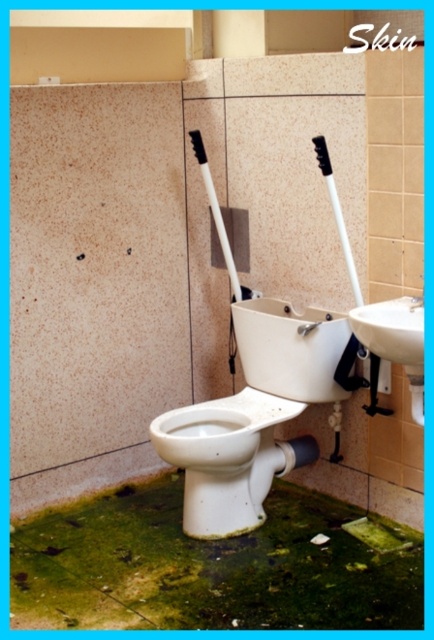
Consider the image. Is white glossy toilet at center below white glossy toilet bowl at center?

Actually, white glossy toilet at center is above white glossy toilet bowl at center.

Does white glossy toilet at center have a lesser height compared to white glossy toilet bowl at center?

No.

Is point (209, 522) more distant than point (240, 476)?

No, it is not.

Locate an element on the screen. white glossy toilet at center is located at coordinates (253, 417).